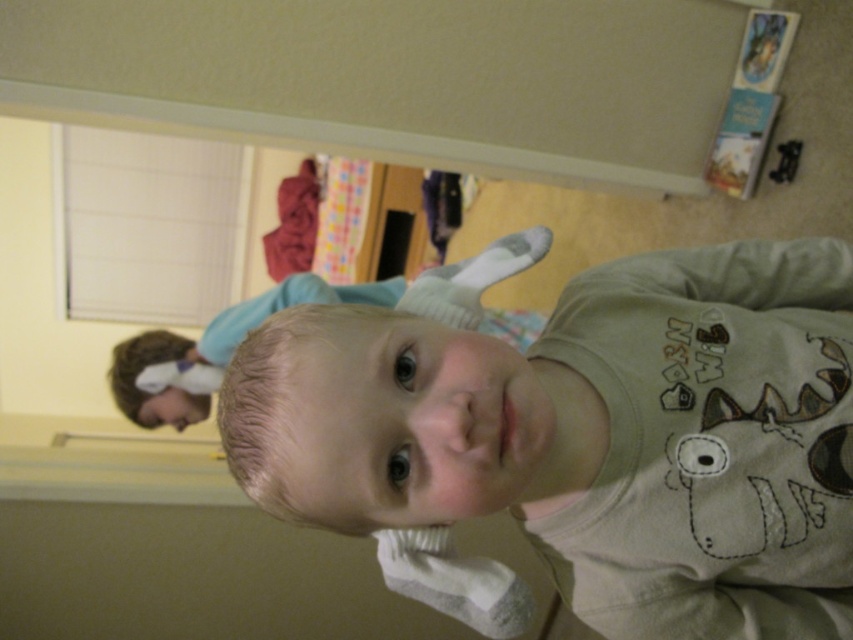
Between light brown cotton shirt at center and smooth beige baby at center, which one is positioned lower?

light brown cotton shirt at center is below.

Identify the location of light brown cotton shirt at center. (592, 435).